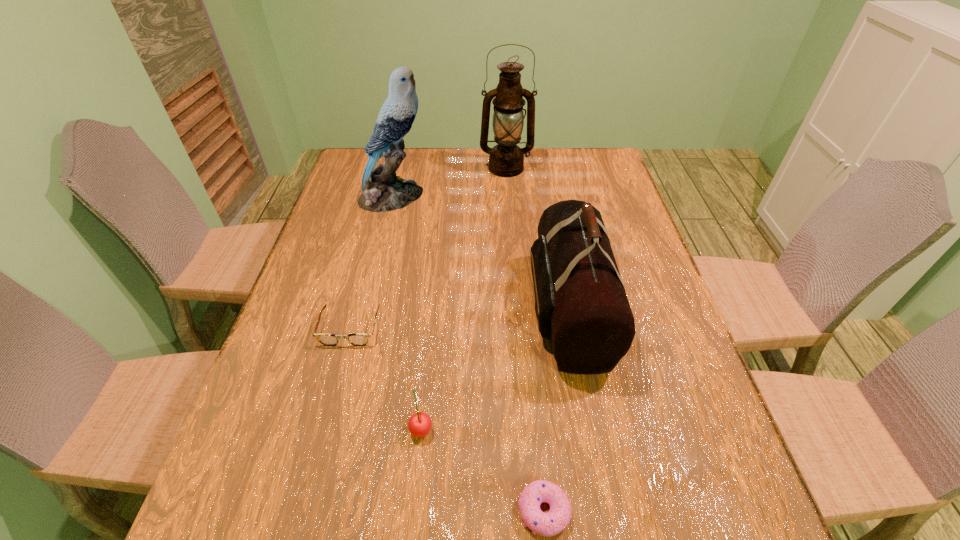
Locate an element on the screen. The width and height of the screenshot is (960, 540). free space located 0.350m on the front pocket of the third tallest object is located at coordinates (386, 309).

The width and height of the screenshot is (960, 540). Find the location of `vacant space located 0.050m on the front pocket of the third tallest object`. vacant space located 0.050m on the front pocket of the third tallest object is located at coordinates (509, 309).

Locate an element on the screen. This screenshot has height=540, width=960. vacant space located on the back of the fourth object from right to left is located at coordinates click(434, 296).

You are a GUI agent. You are given a task and a screenshot of the screen. Output one action in this format:
    pyautogui.click(x=<x>, y=<y>)
    Task: Click on the blank area located on the frame of the spectacles
    The image size is (960, 540).
    Given the screenshot: What is the action you would take?
    pyautogui.click(x=299, y=522)

Find the location of a particular element. The height and width of the screenshot is (540, 960). vacant region located 0.180m on the right of the nearest object is located at coordinates (674, 511).

In order to click on oil lamp positioned at the far edge in this screenshot , I will do `click(506, 159)`.

Find the location of a particular element. parakeet that is at the far edge is located at coordinates (382, 191).

At what (x,y) coordinates should I click in order to perform the action: click on object situated at the near edge. Please return your answer as a coordinate pair (x, y). This screenshot has width=960, height=540. Looking at the image, I should click on (548, 524).

This screenshot has height=540, width=960. Find the location of `parakeet at the left edge`. parakeet at the left edge is located at coordinates (382, 191).

Locate an element on the screen. The height and width of the screenshot is (540, 960). spectacles at the left edge is located at coordinates (357, 339).